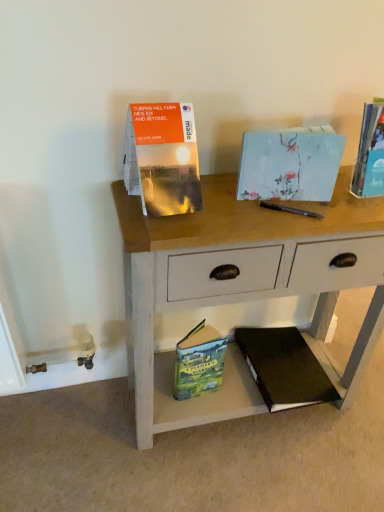
I want to click on blank area to the left of wooden desk at center, so click(x=75, y=437).